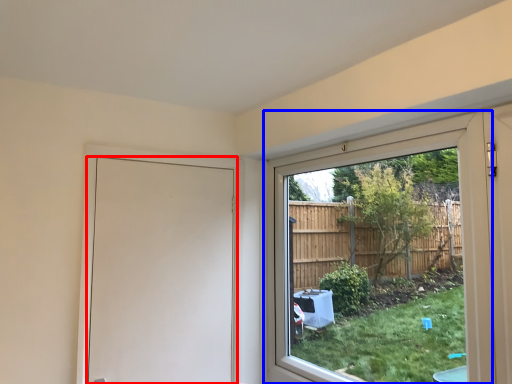
Question: Which object appears closest to the camera in this image, door (highlighted by a red box) or window (highlighted by a blue box)?

Choices:
 (A) door
 (B) window

Answer: (B)